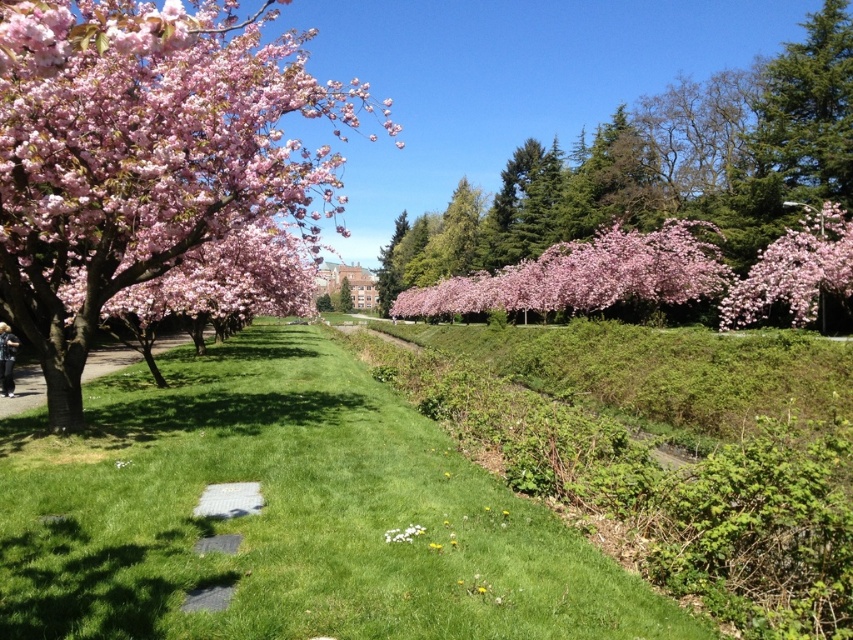
You are standing at the point with coordinates 0.7, 0.3 in the park. You want to walk to the green grass at center. Which direction should you move in?

Since the green grass at center is located at point (287, 515), you should move northeast to reach it from your current position at (254, 448).

You are standing at the entrance of the park and want to reach a specific location. You see two points marked in the image. Which point is closer to you, point at (544, 540) or point at (781, 275)?

Point at (544, 540) is closer to you than point at (781, 275).

You are standing at the entrance of the park and see the green grass at center and the pink matte flower at center. Which object is nearer to you?

The green grass at center is closer to the viewer than the pink matte flower at center.